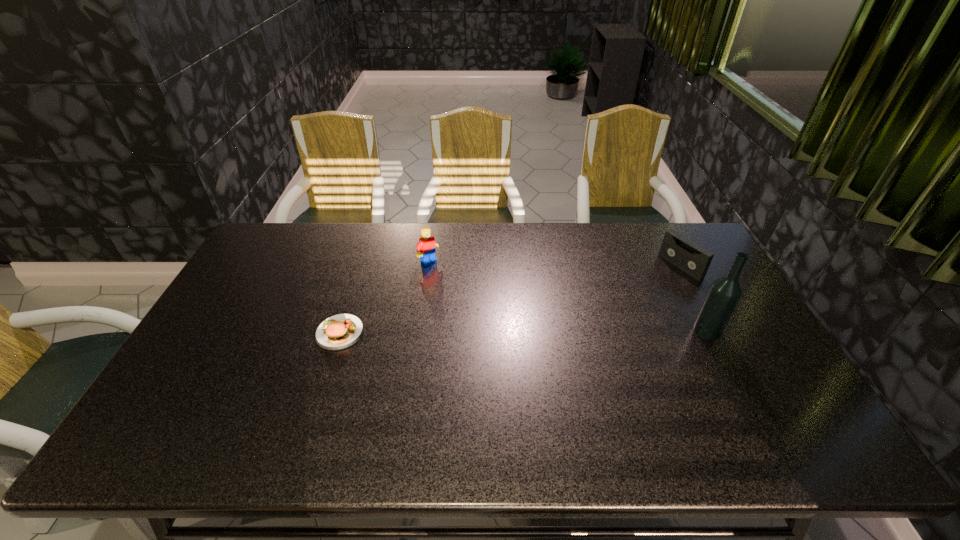
The width and height of the screenshot is (960, 540). What are the coordinates of `empty space between the tallest object and the patty` in the screenshot? It's located at (523, 332).

Locate an element on the screen. The width and height of the screenshot is (960, 540). free space that is in between the shortest object and the third tallest object is located at coordinates (510, 299).

Locate an element on the screen. This screenshot has width=960, height=540. vacant region between the patty and the third shortest object is located at coordinates (384, 297).

Locate an element on the screen. This screenshot has width=960, height=540. the second closest object to the third tallest object is located at coordinates (426, 249).

Where is `the second closest object to the tallest object`? Image resolution: width=960 pixels, height=540 pixels. the second closest object to the tallest object is located at coordinates (426, 249).

Locate an element on the screen. vacant space that satisfies the following two spatial constraints: 1. on the back side of the leftmost object; 2. on the left side of the Lego is located at coordinates (363, 261).

What are the coordinates of `vacant position in the image that satisfies the following two spatial constraints: 1. on the back side of the patty; 2. on the left side of the videotape` in the screenshot? It's located at (361, 266).

This screenshot has height=540, width=960. Identify the location of vacant space that satisfies the following two spatial constraints: 1. on the back side of the videotape; 2. on the left side of the leftmost object. (361, 266).

The image size is (960, 540). I want to click on free spot that satisfies the following two spatial constraints: 1. on the back side of the vodka; 2. on the left side of the second shortest object, so click(673, 266).